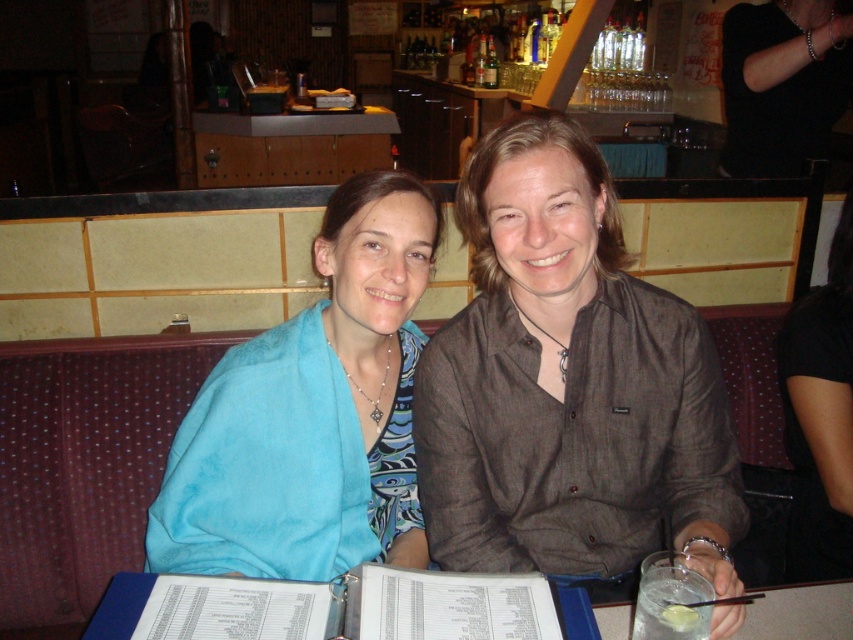
You are a photographer trying to capture a group photo of the brown textured shirt at center and the black matte shirt at upper center. If your camera has a minimum focus distance of 20 inches, will you be able to take the photo without moving either of them?

The brown textured shirt at center and the black matte shirt at upper center are 21.89 inches apart. Since the distance between them is greater than the camera minimum focus distance of 20 inches, the photographer can take the photo without moving either of them.

You are a bartender preparing drinks for two customers. You have a black matte shirt at upper center and a clear glass at lower right. Which item is located to the right of the other?

The black matte shirt at upper center is positioned on the right side of clear glass at lower right.

You are a server at the bar and need to deliver a drink to the customer. The blue fabric at center and white paper menu at center are in the way. Which item should you move to access the customer?

The blue fabric at center is positioned over white paper menu at center, so you should move the blue fabric at center to access the customer.